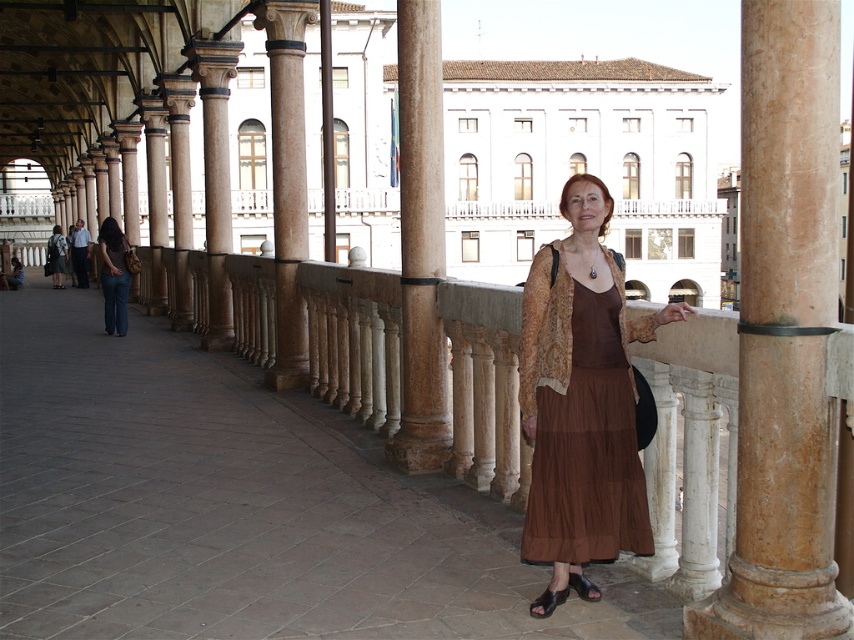
You are standing in the plaza and want to know how far the point marked as point (629, 333) is from you. Can you determine the distance?

The point marked as point (629, 333) is 28.93 feet away from the viewer.

Where is the brown sheer dress at center located in the image?

The brown sheer dress at center is located at point (x=580, y=419).

You are standing at point (547,600) and want to walk to point (320,108). Which direction should you face to move towards your destination?

You should face towards the direction opposite of point (547,600) because point (320,108) is behind it.